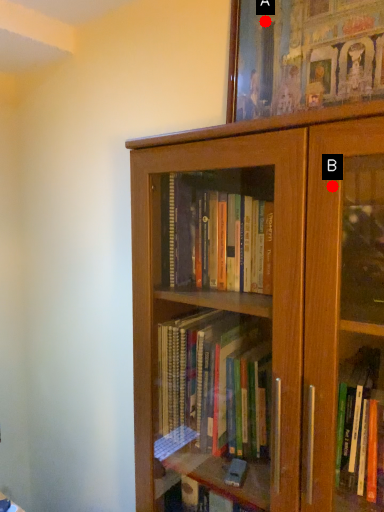
Question: Two points are circled on the image, labeled by A and B beside each circle. Which point is farther to the camera?

Choices:
 (A) A is further
 (B) B is further

Answer: (A)